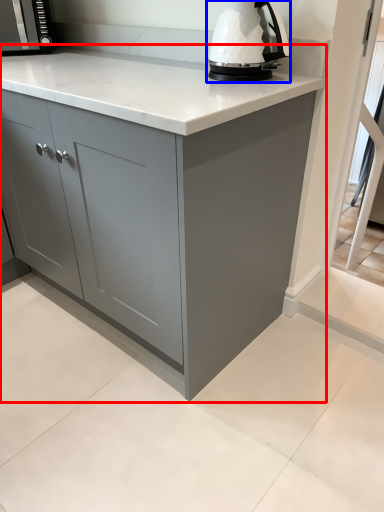
Question: Which point is closer to the camera, cabinetry (highlighted by a red box) or home appliance (highlighted by a blue box)?

Choices:
 (A) cabinetry
 (B) home appliance

Answer: (A)